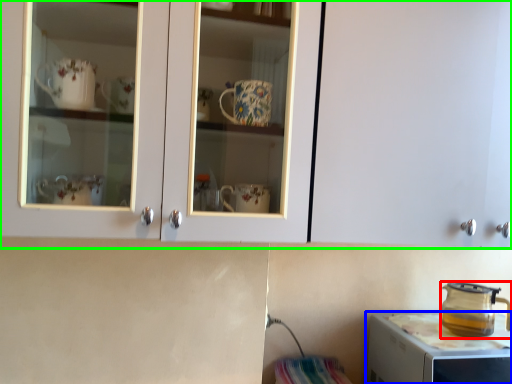
Question: Estimate the real-world distances between objects in this image. Which object is closer to kitchen appliance (highlighted by a red box), home appliance (highlighted by a blue box) or cabinetry (highlighted by a green box)?

Choices:
 (A) home appliance
 (B) cabinetry

Answer: (A)